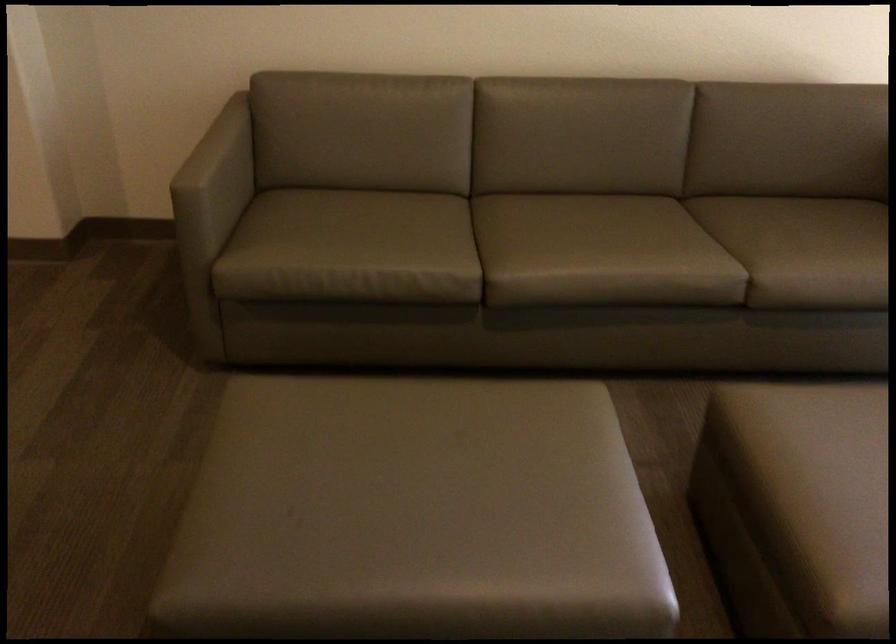
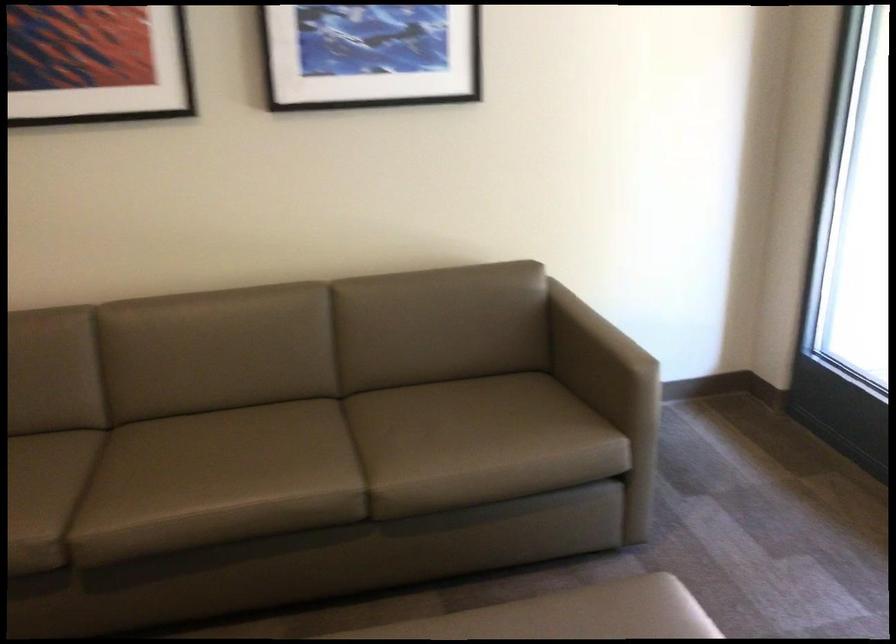
Question: The first image is from the beginning of the video and the second image is from the end. How did the camera likely rotate when shooting the video?

Choices:
 (A) Left
 (B) Right
 (C) Up
 (D) Down

Answer: (C)